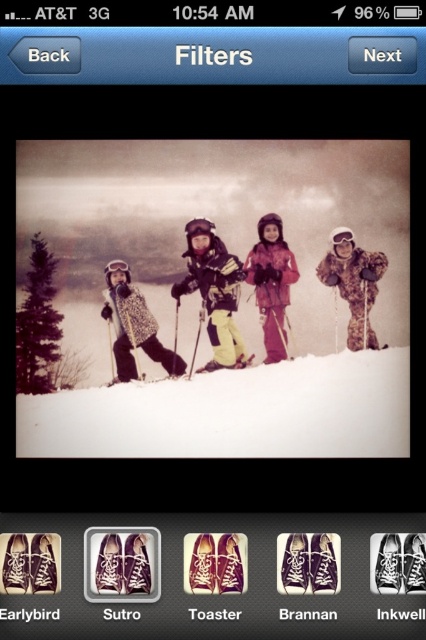
Who is taller, yellow ski suit at center or yellow matte ski at center?

yellow ski suit at center

Does yellow ski suit at center appear under yellow matte ski at center?

Incorrect, yellow ski suit at center is not positioned below yellow matte ski at center.

Locate an element on the screen. The image size is (426, 640). yellow ski suit at center is located at coordinates tap(213, 291).

In the scene shown: Does pink matte snowsuit at center have a smaller size compared to yellow matte ski at center?

Actually, pink matte snowsuit at center might be larger than yellow matte ski at center.

This screenshot has width=426, height=640. What do you see at coordinates (271, 284) in the screenshot?
I see `pink matte snowsuit at center` at bounding box center [271, 284].

Between point (290, 272) and point (218, 364), which one is positioned behind?

Point (290, 272)

The width and height of the screenshot is (426, 640). I want to click on pink matte snowsuit at center, so click(271, 284).

Does leather jacket at left come in front of yellow matte ski at center?

Yes, leather jacket at left is in front of yellow matte ski at center.

Does leather jacket at left appear under yellow matte ski at center?

No, leather jacket at left is not below yellow matte ski at center.

Locate an element on the screen. leather jacket at left is located at coordinates (134, 324).

Find the location of a particular element. The image size is (426, 640). leather jacket at left is located at coordinates (134, 324).